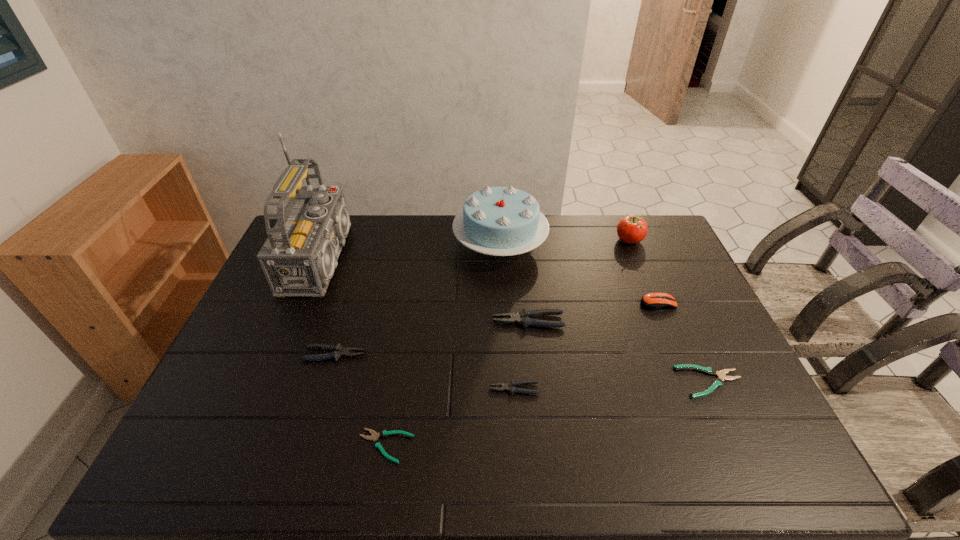
This screenshot has width=960, height=540. What are the coordinates of `object present at the far right corner` in the screenshot? It's located at (631, 229).

In the image, there is a desktop. What are the coordinates of `free space at the far edge` in the screenshot? It's located at (449, 222).

In the image, there is a desktop. At what (x,y) coordinates should I click in order to perform the action: click on vacant space at the near edge. Please return your answer as a coordinate pair (x, y). The image size is (960, 540). Looking at the image, I should click on (377, 451).

Where is `vacant space at the right edge`? This screenshot has height=540, width=960. vacant space at the right edge is located at coordinates [x=662, y=292].

Locate an element on the screen. The width and height of the screenshot is (960, 540). free space at the far right corner is located at coordinates (676, 248).

Find the location of a particular element. The image size is (960, 540). vacant area between the red tomato and the birthday cake is located at coordinates (564, 242).

The height and width of the screenshot is (540, 960). Identify the location of free space between the eighth tallest object and the tallest pliers. (619, 352).

At what (x,y) coordinates should I click in order to perform the action: click on unoccupied area between the nearer teal pliers and the computer mouse. Please return your answer as a coordinate pair (x, y). Looking at the image, I should click on (521, 375).

Identify the location of empty space between the birthday cake and the fifth nearest object. This screenshot has width=960, height=540. (515, 283).

Image resolution: width=960 pixels, height=540 pixels. Identify the location of free spot between the computer mouse and the third shortest object. (586, 346).